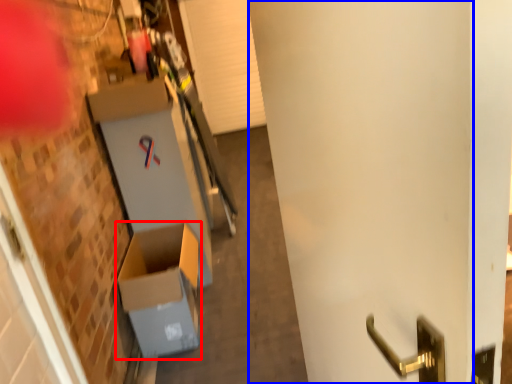
Question: Which point is further to the camera, cardboard box (highlighted by a red box) or door (highlighted by a blue box)?

Choices:
 (A) cardboard box
 (B) door

Answer: (A)